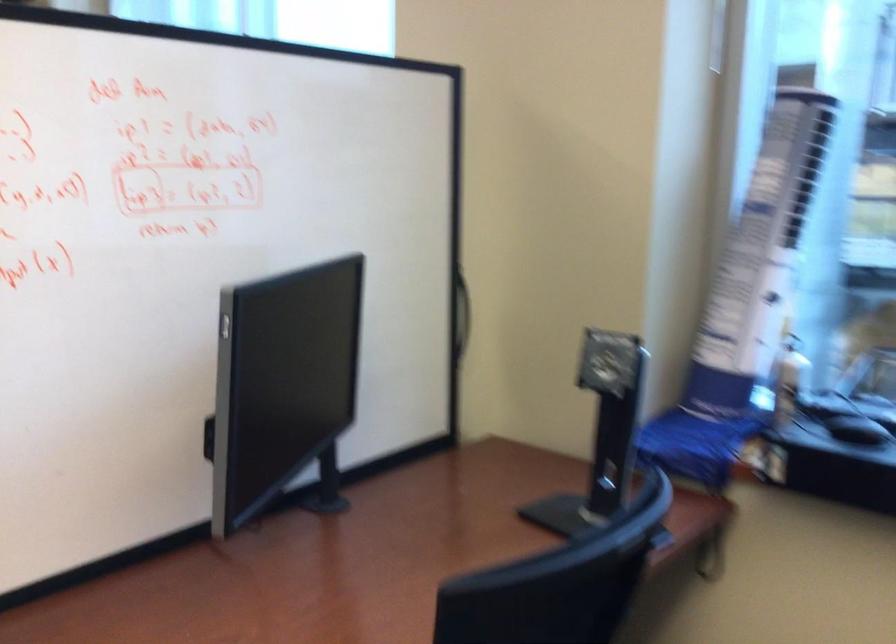
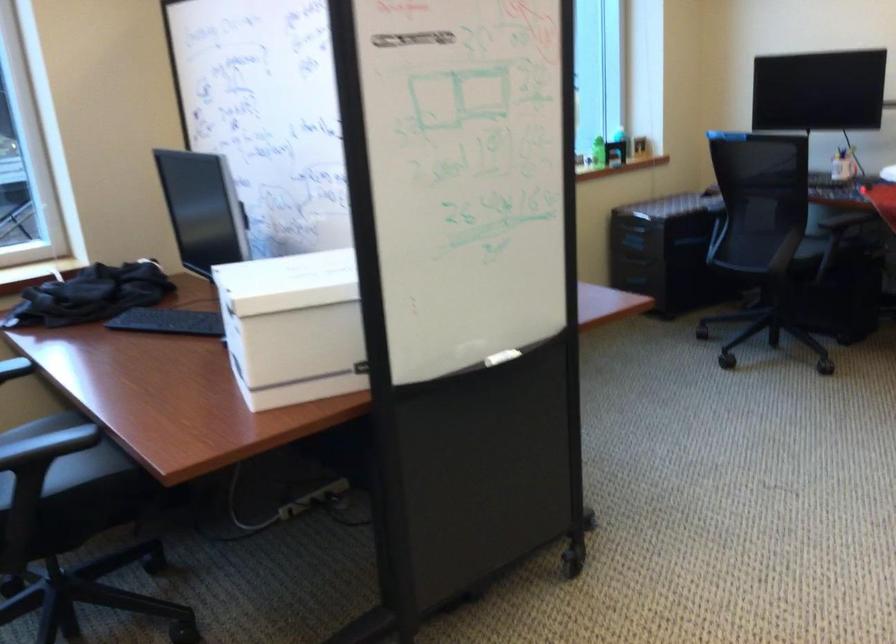
Question: I am providing you with two images of the same scene from different viewpoints. After the viewpoint changes to image2, which objects are now occluded?

Choices:
 (A) cabinet drawer handle
 (B) orange desk calendar
 (C) silver monitor button
 (D) chair sitting surface

Answer: (C)